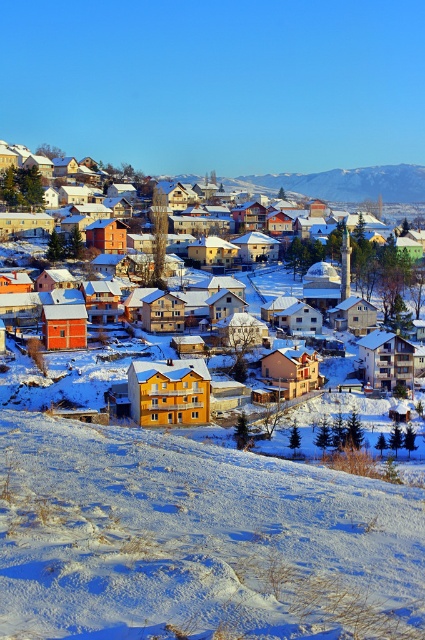
Which of these two, white powdery snow at lower left or yellow matte building at center, stands shorter?

With less height is white powdery snow at lower left.

Measure the distance between white powdery snow at lower left and camera.

The distance of white powdery snow at lower left from camera is 20.81 meters.

Image resolution: width=425 pixels, height=640 pixels. I want to click on white powdery snow at lower left, so click(x=197, y=540).

In order to click on white powdery snow at lower left in this screenshot , I will do `click(197, 540)`.

Looking at this image, is white powdery snow at lower left smaller than snowy mountain range at upper center?

Indeed, white powdery snow at lower left has a smaller size compared to snowy mountain range at upper center.

What do you see at coordinates (197, 540) in the screenshot? I see `white powdery snow at lower left` at bounding box center [197, 540].

Is point (14, 593) farther from camera compared to point (291, 182)?

No, (14, 593) is closer to viewer.

This screenshot has width=425, height=640. Find the location of `white powdery snow at lower left`. white powdery snow at lower left is located at coordinates (197, 540).

Who is more forward, (374, 212) or (385, 198)?

Point (374, 212) is more forward.

You are a GUI agent. You are given a task and a screenshot of the screen. Output one action in this format:
    pyautogui.click(x=<x>, y=<y>)
    Task: Click on the yellow matte building at center
    The width and height of the screenshot is (425, 640).
    Given the screenshot: What is the action you would take?
    pyautogui.click(x=342, y=182)

The height and width of the screenshot is (640, 425). What are the coordinates of `yellow matte building at center` in the screenshot? It's located at (342, 182).